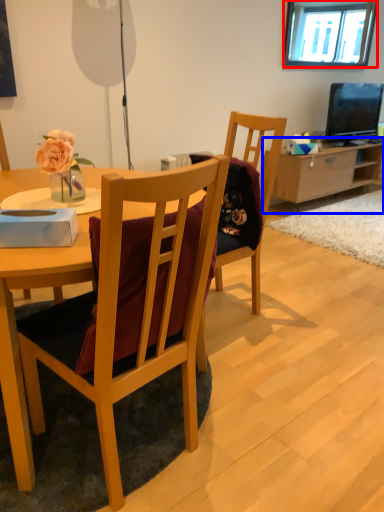
Question: Which point is further to the camera, window (highlighted by a red box) or cabinetry (highlighted by a blue box)?

Choices:
 (A) window
 (B) cabinetry

Answer: (B)